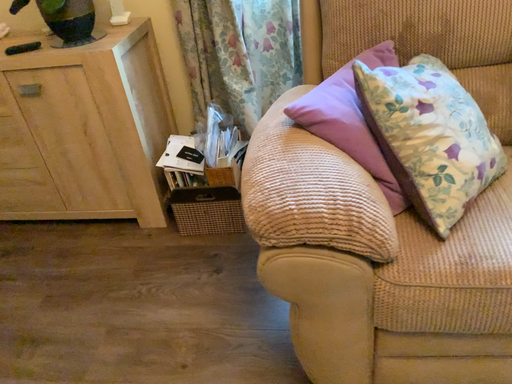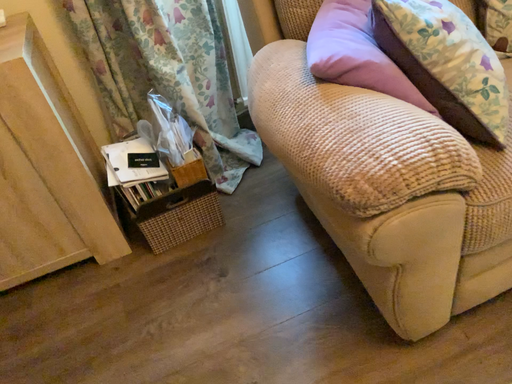
Question: How did the camera likely rotate when shooting the video?

Choices:
 (A) rotated right
 (B) rotated left

Answer: (A)